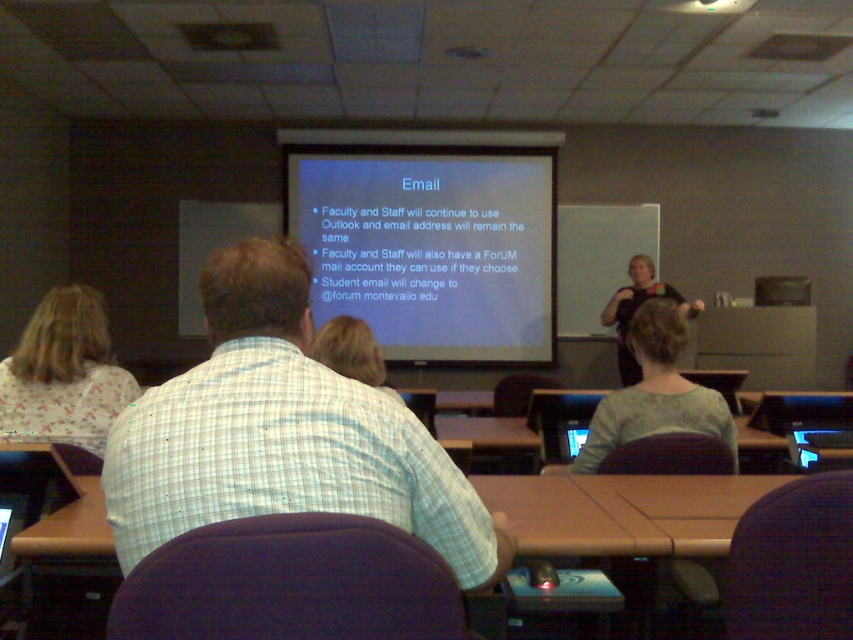
Looking at this image, can you confirm if white matte projector screen at center is thinner than gray fabric shirt at center?

No.

Measure the distance between point (421,285) and camera.

Point (421,285) and camera are 6.75 meters apart from each other.

Find the location of a particular element. The height and width of the screenshot is (640, 853). white matte projector screen at center is located at coordinates (431, 248).

Who is positioned more to the right, white checkered shirt at center or black fabric shirt at upper right?

black fabric shirt at upper right

Does white checkered shirt at center have a greater width compared to black fabric shirt at upper right?

No, white checkered shirt at center is not wider than black fabric shirt at upper right.

Measure the distance between point [239,451] and camera.

1.08 meters

Identify the location of white checkered shirt at center. The image size is (853, 640). (282, 433).

Does white checkered shirt at center appear over white matte projector screen at center?

Actually, white checkered shirt at center is below white matte projector screen at center.

Is white checkered shirt at center further to camera compared to white matte projector screen at center?

That is False.

Is point (202, 492) more distant than point (515, 307)?

No, it is not.

At what (x,y) coordinates should I click in order to perform the action: click on white checkered shirt at center. Please return your answer as a coordinate pair (x, y). Looking at the image, I should click on (282, 433).